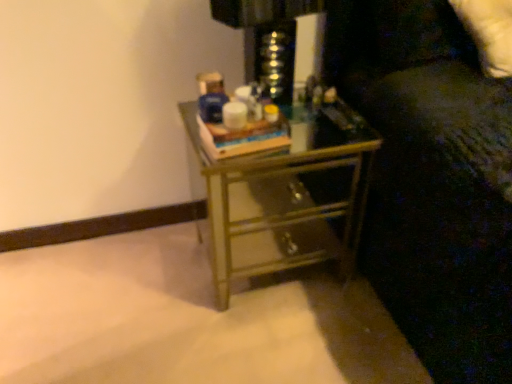
Locate an element on the screen. free space to the left of metallic gold nightstand at center is located at coordinates (140, 279).